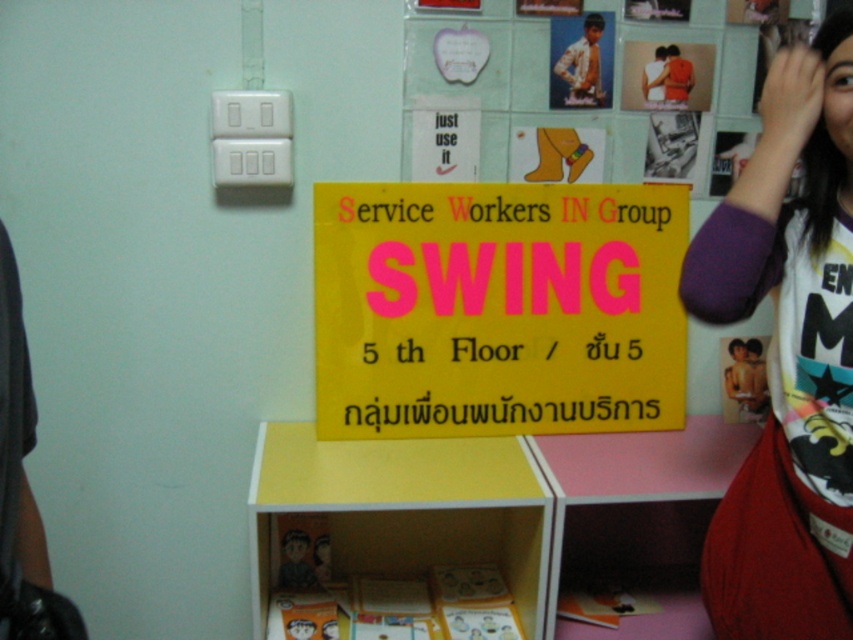
You are standing in a room with a yellow sign in the center. You see two points marked as point 1 and point 2. Point 1 is at coordinate (567, 333) and point 2 is at coordinate (844, 515). If you want to touch the nearest point to you, which point should you choose?

Point 1 at coordinate (567, 333) is closer to you than point 2 at coordinate (844, 515), so you should choose point 1.